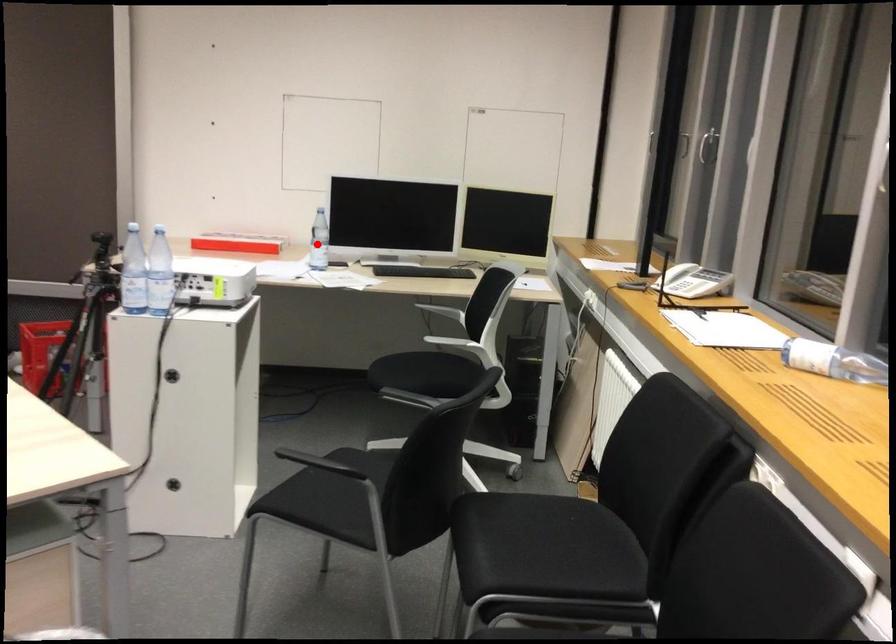
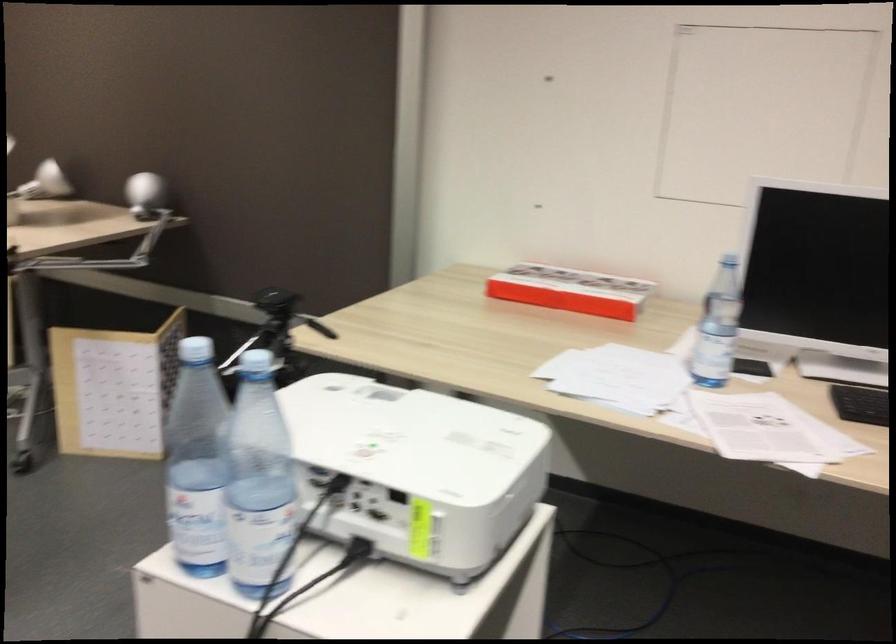
Question: I am providing you with two images of the same scene from different viewpoints. In image1, a red point is highlighted. Considering the same 3D point in image2, which of the following is correct?

Choices:
 (A) It is closer
 (B) It is farther

Answer: (A)